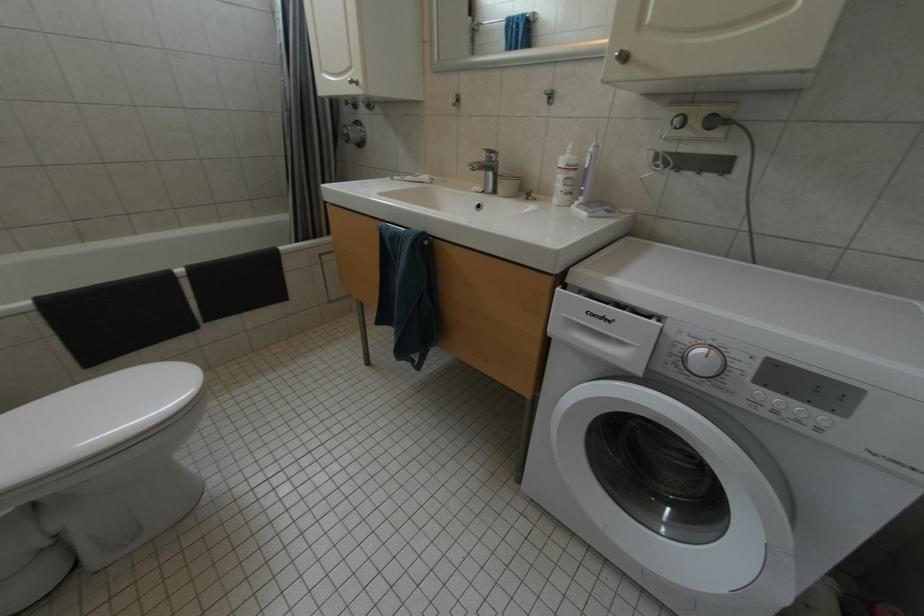
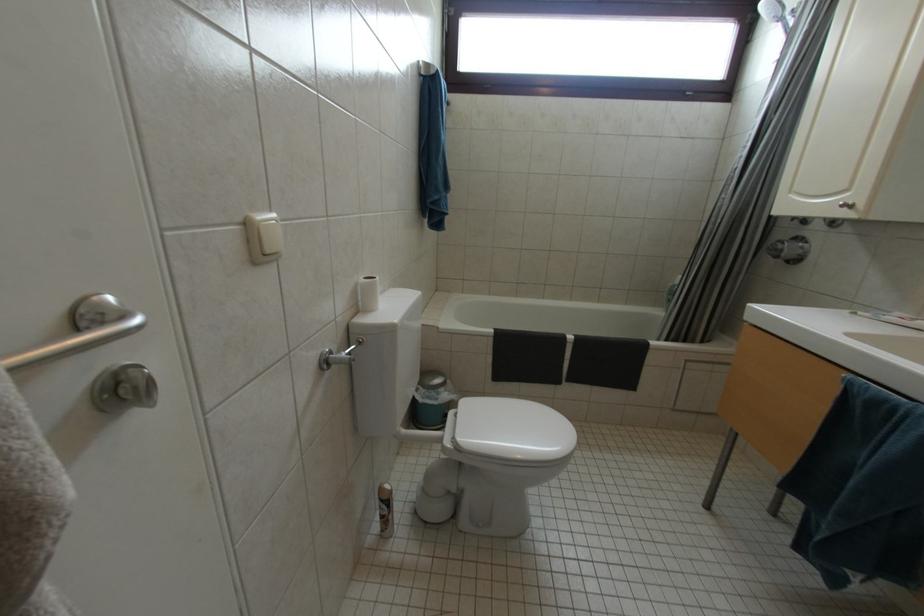
Question: The camera is either moving clockwise (left) or counter-clockwise (right) around the object. The first image is from the beginning of the video and the second image is from the end. Is the camera moving left or right when shooting the video?

Choices:
 (A) Left
 (B) Right

Answer: (B)